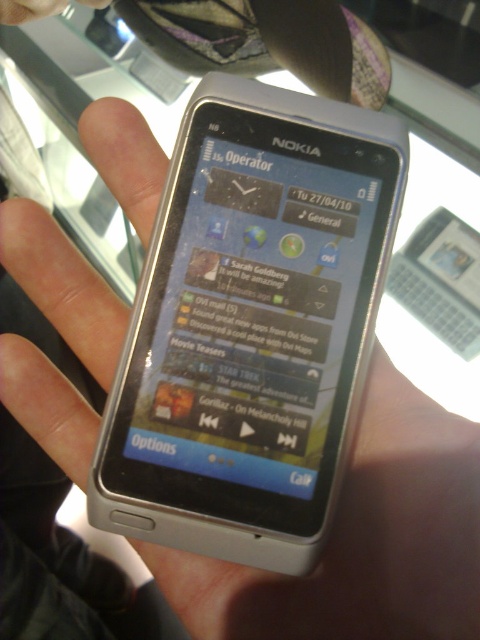
Question: Is silver metallic phone at center below black matte text at upper center?

Choices:
 (A) no
 (B) yes

Answer: (B)

Question: Does silver metallic phone at center appear under black matte text at upper center?

Choices:
 (A) no
 (B) yes

Answer: (B)

Question: Among these objects, which one is farthest from the camera?

Choices:
 (A) black matte text at upper center
 (B) silver metallic phone at center

Answer: (A)

Question: Is silver metallic phone at center closer to camera compared to black matte text at upper center?

Choices:
 (A) no
 (B) yes

Answer: (B)